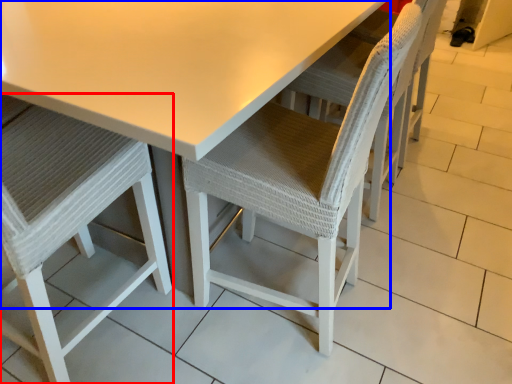
Question: Which of the following is the farthest to the observer, chair (highlighted by a red box) or table (highlighted by a blue box)?

Choices:
 (A) chair
 (B) table

Answer: (B)